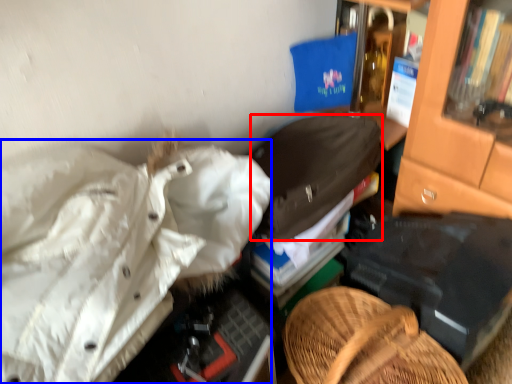
Question: Which object is closer to the camera taking this photo, clothing (highlighted by a red box) or clothing (highlighted by a blue box)?

Choices:
 (A) clothing
 (B) clothing

Answer: (B)